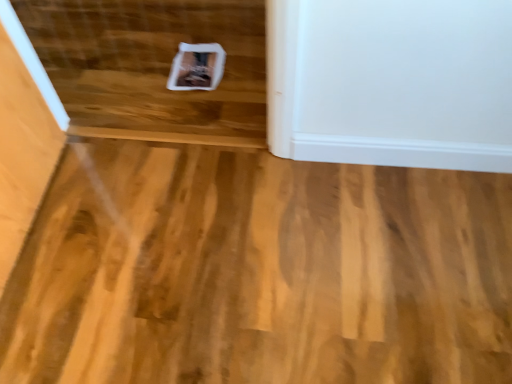
What do you see at coordinates (259, 272) in the screenshot? This screenshot has height=384, width=512. I see `natural wood floor at center` at bounding box center [259, 272].

The width and height of the screenshot is (512, 384). I want to click on natural wood floor at center, so click(259, 272).

Measure the distance between natural wood floor at center and camera.

They are 1.03 meters apart.

Describe the element at coordinates (151, 67) in the screenshot. I see `white paper at center` at that location.

This screenshot has height=384, width=512. I want to click on white paper at center, so click(151, 67).

Measure the distance between white paper at center and camera.

The depth of white paper at center is 1.49 meters.

The width and height of the screenshot is (512, 384). Find the location of `natural wood floor at center`. natural wood floor at center is located at coordinates (259, 272).

Does natural wood floor at center appear on the right side of white paper at center?

Yes, natural wood floor at center is to the right of white paper at center.

Relative to white paper at center, is natural wood floor at center in front or behind?

Visually, natural wood floor at center is located in front of white paper at center.

Considering the positions of point (105, 309) and point (227, 93), is point (105, 309) closer or farther from the camera than point (227, 93)?

Point (105, 309) is closer to the camera than point (227, 93).

From the image's perspective, which is below, natural wood floor at center or white paper at center?

natural wood floor at center appears lower in the image.

From a real-world perspective, who is located lower, natural wood floor at center or white paper at center?

natural wood floor at center, from a real-world perspective.

Is natural wood floor at center thinner than white paper at center?

Yes, natural wood floor at center is thinner than white paper at center.

Considering the relative sizes of natural wood floor at center and white paper at center in the image provided, is natural wood floor at center taller than white paper at center?

In fact, natural wood floor at center may be shorter than white paper at center.

Does natural wood floor at center have a smaller size compared to white paper at center?

No.

Consider the image. Would you say natural wood floor at center contains white paper at center?

Definitely not — white paper at center is not inside natural wood floor at center.

Is the surface of natural wood floor at center in direct contact with white paper at center?

No, natural wood floor at center is not touching white paper at center.

Is white paper at center at the back of natural wood floor at center?

natural wood floor at center does not have its back to white paper at center.

How many degrees apart are the facing directions of natural wood floor at center and white paper at center?

178 degrees separate the facing orientations of natural wood floor at center and white paper at center.

Find the location of `stairwell behind the natural wood floor at center`. stairwell behind the natural wood floor at center is located at coordinates (151, 67).

Considering the relative positions of white paper at center and natural wood floor at center in the image provided, is white paper at center to the left of natural wood floor at center from the viewer's perspective?

Yes.

Based on the photo, which is in front, white paper at center or natural wood floor at center?

natural wood floor at center is more forward.

Considering the positions of points (195, 38) and (154, 277), is point (195, 38) closer to camera compared to point (154, 277)?

No, (195, 38) is behind (154, 277).

From the image's perspective, is white paper at center beneath natural wood floor at center?

No, from the image's perspective, white paper at center is not below natural wood floor at center.

From a real-world perspective, is white paper at center above or below natural wood floor at center?

From a real-world perspective, white paper at center is physically above natural wood floor at center.

Which of these two, white paper at center or natural wood floor at center, is wider?

white paper at center is wider.

Who is taller, white paper at center or natural wood floor at center?

white paper at center.

Does white paper at center have a larger size compared to natural wood floor at center?

No, white paper at center is not bigger than natural wood floor at center.

Would you say white paper at center is inside or outside natural wood floor at center?

white paper at center lies outside natural wood floor at center.

Is white paper at center next to natural wood floor at center and touching it?

white paper at center is not next to natural wood floor at center, and they're not touching.

Is white paper at center aimed at natural wood floor at center?

Yes.

How different are the orientations of white paper at center and natural wood floor at center in degrees?

The angular difference between white paper at center and natural wood floor at center is 178 degrees.

How distant is white paper at center from natural wood floor at center?

white paper at center is 62.42 centimeters away from natural wood floor at center.

The width and height of the screenshot is (512, 384). I want to click on stairwell above the natural wood floor at center (from a real-world perspective), so click(x=151, y=67).

In the image, there is a white paper at center. Identify the location of plywood below it (from a real-world perspective). Image resolution: width=512 pixels, height=384 pixels. (259, 272).

Identify the location of stairwell above the natural wood floor at center (from the image's perspective). click(151, 67).